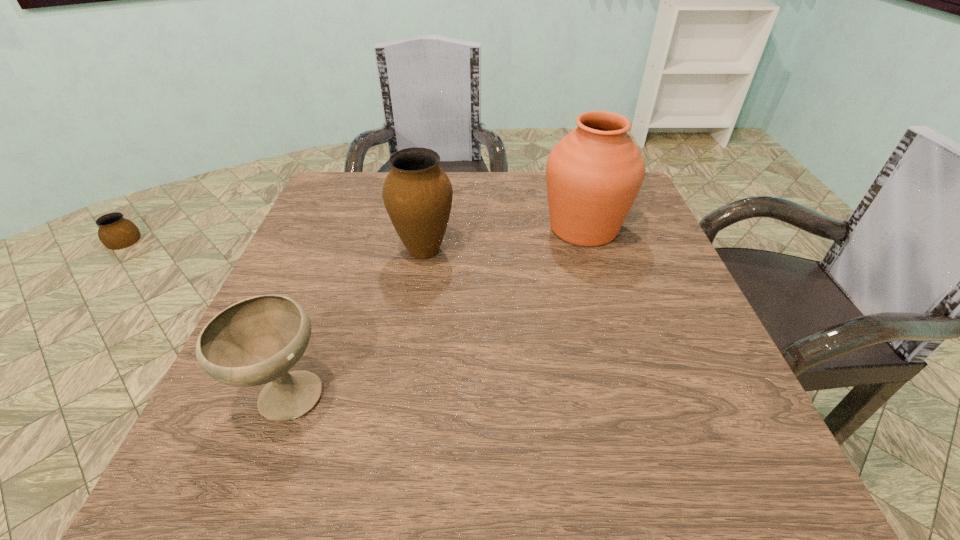
This screenshot has height=540, width=960. I want to click on free area in between the leftmost object and the tallest object, so point(435,312).

In order to click on blank region between the shortest object and the second tallest object in this screenshot , I will do (354, 322).

Where is `free space between the left urn and the shortest object`? free space between the left urn and the shortest object is located at coordinates (354, 322).

The width and height of the screenshot is (960, 540). Identify the location of vacant region between the second object from left to right and the shortest object. (354, 322).

This screenshot has height=540, width=960. Find the location of `vacant area between the second tallest object and the chalice`. vacant area between the second tallest object and the chalice is located at coordinates (354, 322).

Where is `empty space between the second tallest object and the right urn`? This screenshot has width=960, height=540. empty space between the second tallest object and the right urn is located at coordinates (504, 239).

Locate an element on the screen. This screenshot has height=540, width=960. free spot between the nearest object and the rightmost object is located at coordinates (435, 312).

Find the location of a particular element. The width and height of the screenshot is (960, 540). vacant space that is in between the left urn and the right urn is located at coordinates (504, 239).

You are a GUI agent. You are given a task and a screenshot of the screen. Output one action in this format:
    pyautogui.click(x=<x>, y=<y>)
    Task: Click on the vacant region between the taller urn and the shortest object
    
    Given the screenshot: What is the action you would take?
    pyautogui.click(x=435, y=312)

The image size is (960, 540). Identify the location of free space between the second shortest object and the taller urn. (504, 239).